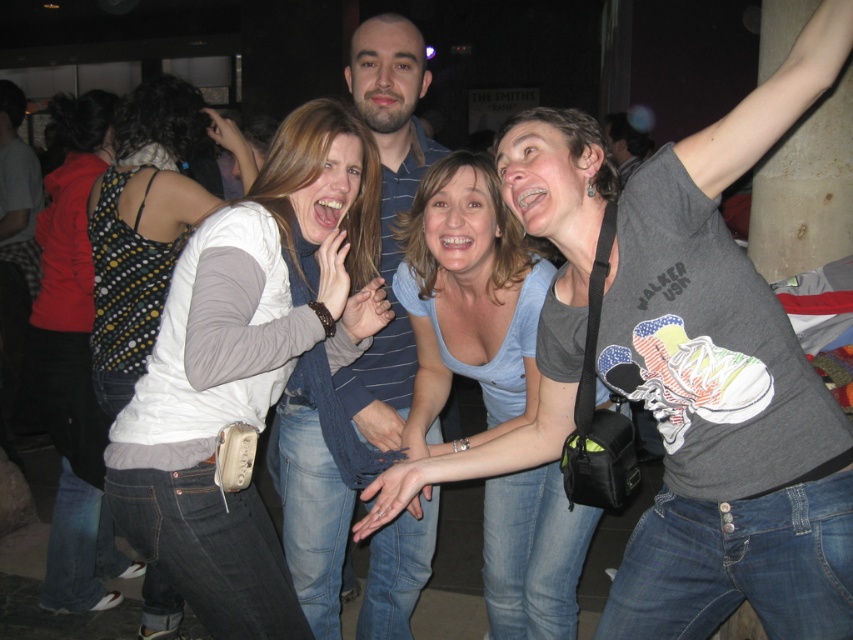
Does blue striped shirt at center have a lesser width compared to polka dot fabric top at left?

Yes, blue striped shirt at center is thinner than polka dot fabric top at left.

This screenshot has height=640, width=853. Describe the element at coordinates (387, 214) in the screenshot. I see `blue striped shirt at center` at that location.

Is point (335, 596) in front of point (80, 371)?

Yes.

This screenshot has height=640, width=853. Identify the location of blue striped shirt at center. (387, 214).

Is point (173, 408) less distant than point (368, 51)?

Yes, it is in front of point (368, 51).

Between white matte vest at center and blue striped shirt at center, which one is positioned higher?

Positioned higher is blue striped shirt at center.

Does point (341, 118) come closer to viewer compared to point (349, 497)?

Yes, it is in front of point (349, 497).

The width and height of the screenshot is (853, 640). In order to click on white matte vest at center in this screenshot , I will do `click(247, 365)`.

Is white matte vest at center thinner than polka dot fabric top at left?

Correct, white matte vest at center's width is less than polka dot fabric top at left's.

Which is behind, point (160, 516) or point (74, 566)?

Point (74, 566)

Is point (170, 412) farther from viewer compared to point (73, 220)?

No, (170, 412) is closer to viewer.

Where is `white matte vest at center`? This screenshot has width=853, height=640. white matte vest at center is located at coordinates (247, 365).